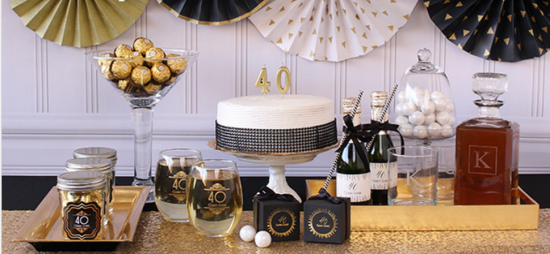
You are a GUI agent. You are given a task and a screenshot of the screen. Output one action in this format:
    pyautogui.click(x=<x>, y=<y>)
    Task: Click on the black table
    The image size is (550, 254).
    Given the screenshot: What is the action you would take?
    pyautogui.click(x=33, y=190)